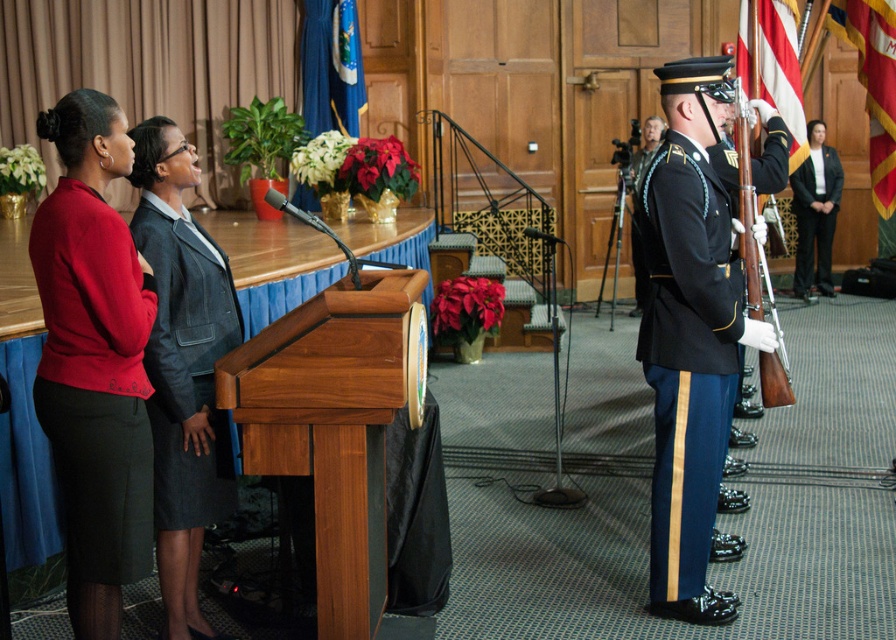
You are organizing a charity event and need to seat the two speakers from the image. The table you have is 1.2 meters wide. The matte red sweater at left and the gray wool suit at center are sitting side by side. Will they both fit comfortably on the table if each requires 0.6 meters of space?

The matte red sweater at left is wider than the gray wool suit at center. Since each requires 0.6 meters of space, the total required space would be 1.2 meters. The table is exactly 1.2 meters wide, so they can just fit, but there will be no extra space for anything else.

Consider the image. You are an event organizer who needs to arrange seating for the gray wool suit at center and the black wool suit at right based on their current positions. Since the seating chart requires guests to be seated in order from left to right as they appear in the photo, which guest should be seated first when entering from the left side of the room?

The gray wool suit at center should be seated first because they are positioned to the left of the black wool suit at right in the image, so when entering from the left side of the room, the gray wool suit at center comes before the black wool suit at right.